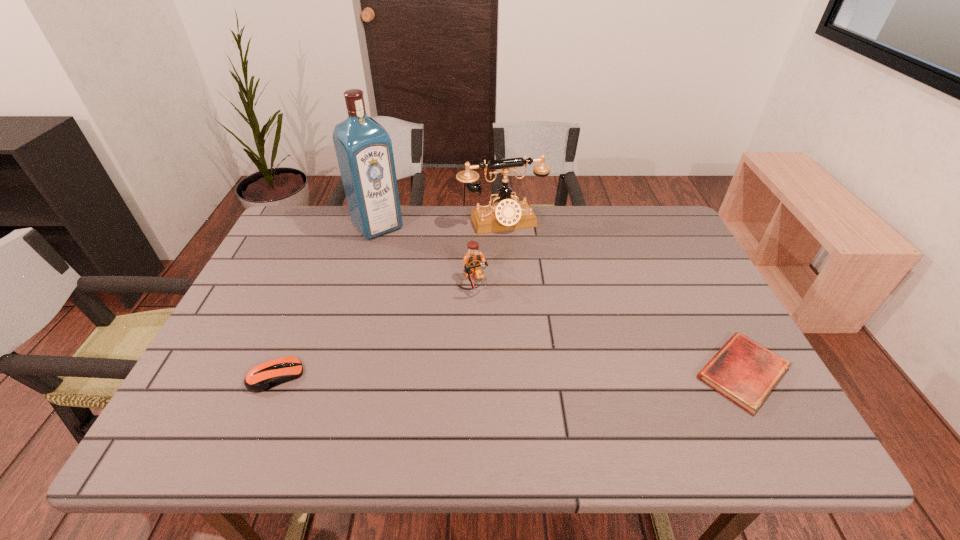
Locate an element on the screen. The width and height of the screenshot is (960, 540). the fourth tallest object is located at coordinates (266, 375).

Where is `the shortest object`? The image size is (960, 540). the shortest object is located at coordinates (743, 371).

Where is `diary`? diary is located at coordinates (743, 371).

Locate an element on the screen. The image size is (960, 540). liquor is located at coordinates (363, 147).

Locate an element on the screen. the third nearest object is located at coordinates (473, 260).

The height and width of the screenshot is (540, 960). Identify the location of Lego. (473, 260).

The height and width of the screenshot is (540, 960). Find the location of `telephone`. telephone is located at coordinates (506, 214).

You are a GUI agent. You are given a task and a screenshot of the screen. Output one action in this format:
    pyautogui.click(x=<x>, y=<y>)
    Task: Click on the vacant space situated 0.100m on the back of the computer mouse
    The image size is (960, 540).
    Given the screenshot: What is the action you would take?
    pyautogui.click(x=297, y=327)

Where is `vacant space located 0.260m on the back of the rightmost object`? vacant space located 0.260m on the back of the rightmost object is located at coordinates (686, 266).

This screenshot has height=540, width=960. Identify the location of free location located 0.340m on the flat label side of the liquor. (445, 304).